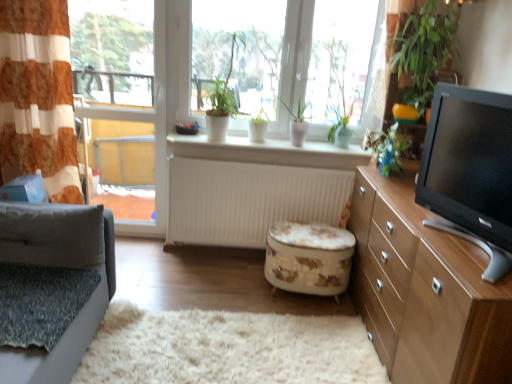
Question: Does green leafy plant at upper right lie behind white matte radiator at center?

Choices:
 (A) yes
 (B) no

Answer: (B)

Question: Is green leafy plant at upper right shorter than white matte radiator at center?

Choices:
 (A) yes
 (B) no

Answer: (A)

Question: Is green leafy plant at upper right wider than white matte radiator at center?

Choices:
 (A) yes
 (B) no

Answer: (A)

Question: Can you confirm if green leafy plant at upper right is taller than white matte radiator at center?

Choices:
 (A) no
 (B) yes

Answer: (A)

Question: Is green leafy plant at upper right facing away from white matte radiator at center?

Choices:
 (A) yes
 (B) no

Answer: (B)

Question: Based on their sizes in the image, would you say light brown wood cabinet at right is bigger or smaller than clear glass window at left?

Choices:
 (A) small
 (B) big

Answer: (B)

Question: Is point (487, 321) positioned closer to the camera than point (155, 34)?

Choices:
 (A) closer
 (B) farther

Answer: (A)

Question: Choose the correct answer: Is light brown wood cabinet at right inside clear glass window at left or outside it?

Choices:
 (A) inside
 (B) outside

Answer: (B)

Question: Considering the positions of light brown wood cabinet at right and clear glass window at left in the image, is light brown wood cabinet at right wider or thinner than clear glass window at left?

Choices:
 (A) wide
 (B) thin

Answer: (A)

Question: In the image, is clear glass window at left positioned in front of or behind floral-patterned fabric ottoman at center?

Choices:
 (A) front
 (B) behind

Answer: (B)

Question: Is clear glass window at left bigger or smaller than floral-patterned fabric ottoman at center?

Choices:
 (A) big
 (B) small

Answer: (A)

Question: From a real-world perspective, relative to floral-patterned fabric ottoman at center, is clear glass window at left vertically above or below?

Choices:
 (A) below
 (B) above

Answer: (B)

Question: Considering the positions of clear glass window at left and floral-patterned fabric ottoman at center in the image, is clear glass window at left taller or shorter than floral-patterned fabric ottoman at center?

Choices:
 (A) short
 (B) tall

Answer: (B)

Question: From their relative heights in the image, would you say black glossy tv at right is taller or shorter than clear glass window at left?

Choices:
 (A) tall
 (B) short

Answer: (B)

Question: Based on their positions, is black glossy tv at right located to the left or right of clear glass window at left?

Choices:
 (A) left
 (B) right

Answer: (B)